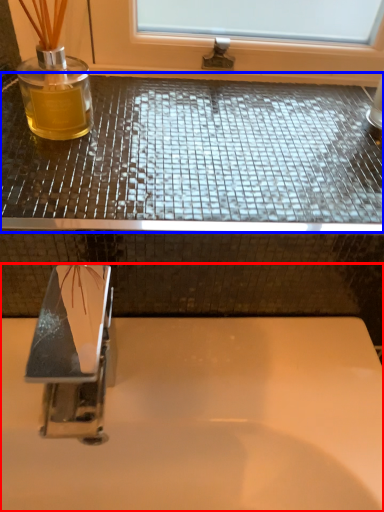
Question: Which object is closer to the camera taking this photo, sink (highlighted by a red box) or counter top (highlighted by a blue box)?

Choices:
 (A) sink
 (B) counter top

Answer: (A)